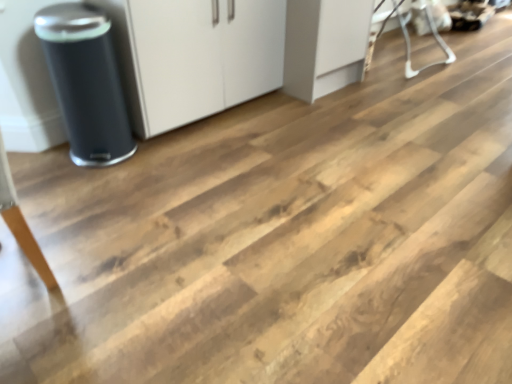
Where is `vacant space in front of white matte cabinet at center`? The width and height of the screenshot is (512, 384). vacant space in front of white matte cabinet at center is located at coordinates (225, 164).